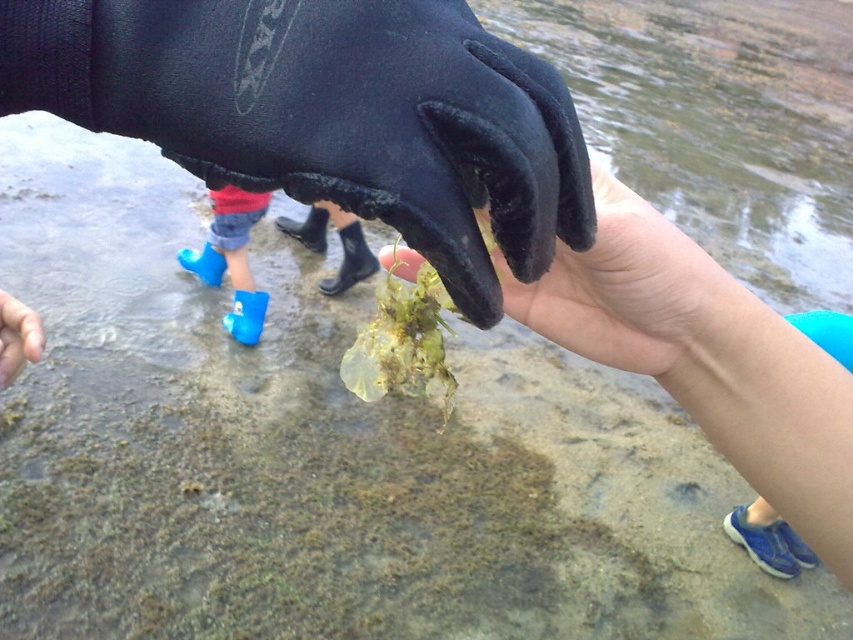
Is black neoprene glove at center above blue rubber boot at lower left?

Indeed, black neoprene glove at center is positioned over blue rubber boot at lower left.

Is black neoprene glove at center shorter than blue rubber boot at lower left?

Indeed, black neoprene glove at center has a lesser height compared to blue rubber boot at lower left.

You are a GUI agent. You are given a task and a screenshot of the screen. Output one action in this format:
    pyautogui.click(x=<x>, y=<y>)
    Task: Click on the black neoprene glove at center
    Image resolution: width=853 pixels, height=640 pixels.
    Given the screenshot: What is the action you would take?
    pyautogui.click(x=328, y=113)

This screenshot has height=640, width=853. What are the coordinates of `black neoprene glove at center` in the screenshot? It's located at (328, 113).

Describe the element at coordinates (328, 113) in the screenshot. The image size is (853, 640). I see `black neoprene glove at center` at that location.

Between point (233, 125) and point (601, 336), which one is positioned behind?

Point (601, 336)

Describe the element at coordinates (328, 113) in the screenshot. I see `black neoprene glove at center` at that location.

At what (x,y) coordinates should I click in order to perform the action: click on black neoprene glove at center. Please return your answer as a coordinate pair (x, y). Image resolution: width=853 pixels, height=640 pixels. Looking at the image, I should click on pyautogui.click(x=328, y=113).

Is point (605, 339) positioned in front of point (717, 346)?

No, it is behind (717, 346).

Does yellowish-green leafy plant at center appear on the left side of matte black glove at center?

Incorrect, yellowish-green leafy plant at center is not on the left side of matte black glove at center.

Is point (590, 336) positioned behind point (695, 321)?

Yes, it is behind point (695, 321).

Where is `yellowish-green leafy plant at center`? The height and width of the screenshot is (640, 853). yellowish-green leafy plant at center is located at coordinates (705, 358).